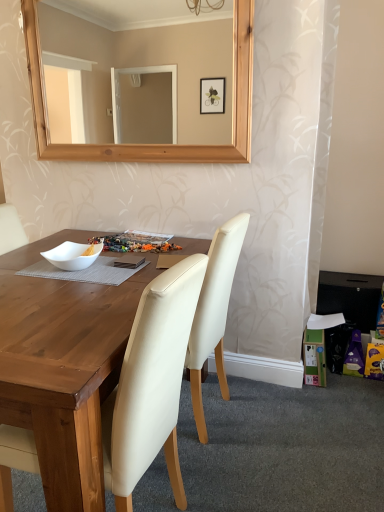
This screenshot has width=384, height=512. Find the location of `unoccupied region to the right of white matte bowl at center`. unoccupied region to the right of white matte bowl at center is located at coordinates (123, 270).